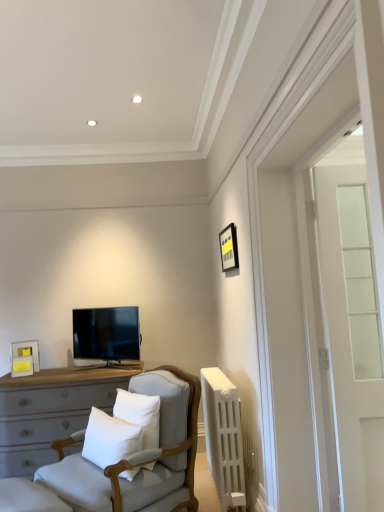
Where is `matte black picture frame at upper right, which is the first picture frame in right-to-left order`? This screenshot has height=512, width=384. matte black picture frame at upper right, which is the first picture frame in right-to-left order is located at coordinates (229, 248).

Image resolution: width=384 pixels, height=512 pixels. What do you see at coordinates (106, 334) in the screenshot?
I see `matte black tv at center` at bounding box center [106, 334].

Describe the element at coordinates (140, 457) in the screenshot. Image resolution: width=384 pixels, height=512 pixels. I see `light gray fabric chair at center` at that location.

The height and width of the screenshot is (512, 384). I want to click on clear glass door at right, so click(x=352, y=333).

Describe the element at coordinates (140, 414) in the screenshot. Image resolution: width=384 pixels, height=512 pixels. I see `white soft cushion at center, the 2th pillow viewed from the left` at that location.

This screenshot has width=384, height=512. I want to click on matte black picture frame at upper right, which is the first picture frame in right-to-left order, so click(x=229, y=248).

Looking at the image, does matte black picture frame at upper right, which is the second picture frame in back-to-front order, seem bigger or smaller compared to white cotton pillow at center, the 2th pillow from the right?

matte black picture frame at upper right, which is the second picture frame in back-to-front order, is smaller than white cotton pillow at center, the 2th pillow from the right.

Visually, is matte black picture frame at upper right, acting as the 1th picture frame starting from the front, positioned to the left or to the right of white cotton pillow at center, the 1th pillow positioned from the left?

matte black picture frame at upper right, acting as the 1th picture frame starting from the front, is to the right of white cotton pillow at center, the 1th pillow positioned from the left.

Is matte black picture frame at upper right, acting as the 1th picture frame starting from the front, shorter than white cotton pillow at center, the 1th pillow positioned from the left?

Indeed, matte black picture frame at upper right, acting as the 1th picture frame starting from the front, has a lesser height compared to white cotton pillow at center, the 1th pillow positioned from the left.

Is matte black picture frame at upper right, the second picture frame from the bottom, next to white cotton pillow at center, the 1th pillow positioned from the left?

There is a gap between matte black picture frame at upper right, the second picture frame from the bottom, and white cotton pillow at center, the 1th pillow positioned from the left.

How many degrees apart are the facing directions of matte black picture frame at upper right, which ranks as the second picture frame in left-to-right order, and matte white picture frame at left, which appears as the first picture frame when ordered from the bottom?

There is a 109-degree angle between the facing directions of matte black picture frame at upper right, which ranks as the second picture frame in left-to-right order, and matte white picture frame at left, which appears as the first picture frame when ordered from the bottom.

Is matte black picture frame at upper right, the 1th picture frame viewed from the top, thinner than matte white picture frame at left, the second picture frame in the front-to-back sequence?

Correct, the width of matte black picture frame at upper right, the 1th picture frame viewed from the top, is less than that of matte white picture frame at left, the second picture frame in the front-to-back sequence.

Where is `picture frame that is behind the matte black picture frame at upper right, acting as the 1th picture frame starting from the front`? This screenshot has width=384, height=512. picture frame that is behind the matte black picture frame at upper right, acting as the 1th picture frame starting from the front is located at coordinates (24, 358).

From a real-world perspective, is matte black picture frame at upper right, which is the second picture frame in back-to-front order, located beneath matte white picture frame at left, the 2th picture frame viewed from the top?

No.

Considering the relative sizes of clear glass door at right and matte white picture frame at left, which appears as the first picture frame when ordered from the bottom, in the image provided, is clear glass door at right wider than matte white picture frame at left, which appears as the first picture frame when ordered from the bottom,?

Yes, clear glass door at right is wider than matte white picture frame at left, which appears as the first picture frame when ordered from the bottom.

From the image's perspective, is clear glass door at right over matte white picture frame at left, which is the first picture frame in left-to-right order?

Indeed, from the image's perspective, clear glass door at right is shown above matte white picture frame at left, which is the first picture frame in left-to-right order.

From the image's perspective, does matte white picture frame at left, the 2th picture frame viewed from the top, appear higher than clear glass door at right?

Incorrect, from the image's perspective, matte white picture frame at left, the 2th picture frame viewed from the top, is lower than clear glass door at right.

Is clear glass door at right inside matte white picture frame at left, which ranks as the 1th picture frame in back-to-front order?

Definitely not — clear glass door at right is not inside matte white picture frame at left, which ranks as the 1th picture frame in back-to-front order.

How many degrees apart are the facing directions of matte white picture frame at left, which is the first picture frame in left-to-right order, and clear glass door at right?

22.6 degrees.

Is point (127, 308) positioned behind point (359, 387)?

Yes, point (127, 308) is behind point (359, 387).

From a real-world perspective, which is physically above, matte black tv at center or clear glass door at right?

In real-world perspective, clear glass door at right is above.

From the image's perspective, is matte black tv at center positioned above or below clear glass door at right?

matte black tv at center is below clear glass door at right.

Where is `glass door that is above the matte black tv at center (from the image's perspective)`? glass door that is above the matte black tv at center (from the image's perspective) is located at coordinates (352, 333).

Consider the image. Considering the sizes of matte black tv at center and white cotton pillow at center, the 1th pillow positioned from the left, in the image, is matte black tv at center wider or thinner than white cotton pillow at center, the 1th pillow positioned from the left,?

Considering their sizes, matte black tv at center looks broader than white cotton pillow at center, the 1th pillow positioned from the left.

Are matte black tv at center and white cotton pillow at center, the 2th pillow from the right, making contact?

matte black tv at center and white cotton pillow at center, the 2th pillow from the right, are not in contact.

Between point (80, 359) and point (105, 458), which one is positioned behind?

Positioned behind is point (80, 359).

Which is more to the left, white plastic radiator at right or light gray fabric chair at center?

light gray fabric chair at center is more to the left.

Where is `chair located above the white plastic radiator at right (from a real-world perspective)`? The image size is (384, 512). chair located above the white plastic radiator at right (from a real-world perspective) is located at coordinates (140, 457).

Consider the image. Is white plastic radiator at right further to the viewer compared to light gray fabric chair at center?

Yes, the depth of white plastic radiator at right is greater than that of light gray fabric chair at center.

From a real-world perspective, is white plastic radiator at right physically located above or below light gray fabric chair at center?

white plastic radiator at right is below light gray fabric chair at center.

Identify the location of the 2nd pillow positioned below the matte black picture frame at upper right, which ranks as the second picture frame in left-to-right order (from a real-world perspective). [x=110, y=439].

Identify the location of picture frame on the left of matte black picture frame at upper right, the second picture frame from the bottom. This screenshot has height=512, width=384. click(24, 358).

When comparing their distances from white soft cushion at center, which is the 1th pillow from right to left, does matte white picture frame at left, which appears as the first picture frame when ordered from the bottom, or white cotton pillow at center, the 2th pillow from the right, seem closer?

white cotton pillow at center, the 2th pillow from the right, is closer to white soft cushion at center, which is the 1th pillow from right to left.

Looking at the image, which one is located closer to matte black picture frame at upper right, which is the second picture frame in back-to-front order, light gray fabric chair at center or clear glass door at right?

clear glass door at right lies closer to matte black picture frame at upper right, which is the second picture frame in back-to-front order, than the other object.

Which object lies nearer to the anchor point light gray fabric chair at center, matte black picture frame at upper right, acting as the 1th picture frame starting from the front, or white cotton pillow at center, the 1th pillow positioned from the left?

Among the two, white cotton pillow at center, the 1th pillow positioned from the left, is located nearer to light gray fabric chair at center.

Considering their positions, is matte white picture frame at left, which ranks as the 1th picture frame in back-to-front order, positioned further to white plastic radiator at right than white cotton pillow at center, the 2th pillow from the right?

matte white picture frame at left, which ranks as the 1th picture frame in back-to-front order, is further to white plastic radiator at right.

Based on their spatial positions, is clear glass door at right or matte white picture frame at left, which is the first picture frame in left-to-right order, closer to matte black tv at center?

matte white picture frame at left, which is the first picture frame in left-to-right order, lies closer to matte black tv at center than the other object.

Based on their spatial positions, is matte black picture frame at upper right, which is the second picture frame in back-to-front order, or light gray fabric chair at center closer to white soft cushion at center, which is the 1th pillow from right to left?

light gray fabric chair at center lies closer to white soft cushion at center, which is the 1th pillow from right to left, than the other object.

Based on their spatial positions, is light gray fabric chair at center or white soft cushion at center, the 2th pillow viewed from the left, closer to matte white picture frame at left, which is the first picture frame in left-to-right order?

white soft cushion at center, the 2th pillow viewed from the left, is closer to matte white picture frame at left, which is the first picture frame in left-to-right order.

In the scene shown: Which object lies further to the anchor point matte black tv at center, matte white picture frame at left, which appears as the 2th picture frame when viewed from the right, or clear glass door at right?

clear glass door at right is further to matte black tv at center.

Find the location of a particular element. pillow between light gray fabric chair at center and white plastic radiator at right in the horizontal direction is located at coordinates (140, 414).

This screenshot has height=512, width=384. I want to click on television that lies between matte black picture frame at upper right, the 1th picture frame viewed from the top, and white plastic radiator at right from top to bottom, so click(x=106, y=334).

Where is `chair between matte white picture frame at left, the 2th picture frame viewed from the top, and matte black picture frame at upper right, which is the first picture frame in right-to-left order, in the horizontal direction`? This screenshot has height=512, width=384. chair between matte white picture frame at left, the 2th picture frame viewed from the top, and matte black picture frame at upper right, which is the first picture frame in right-to-left order, in the horizontal direction is located at coordinates click(x=140, y=457).

At what (x,y) coordinates should I click in order to perform the action: click on television located between light gray fabric chair at center and matte white picture frame at left, which ranks as the 1th picture frame in back-to-front order, in the depth direction. Please return your answer as a coordinate pair (x, y). Looking at the image, I should click on (106, 334).